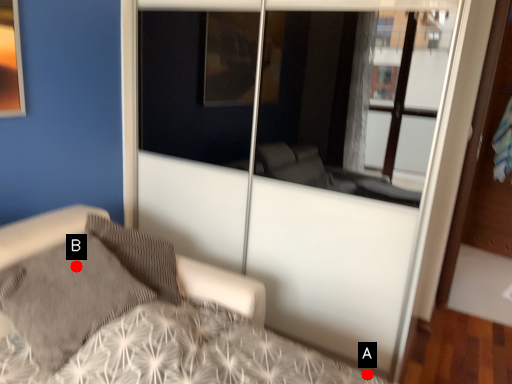
Question: Two points are circled on the image, labeled by A and B beside each circle. Which point is closer to the camera?

Choices:
 (A) A is closer
 (B) B is closer

Answer: (B)